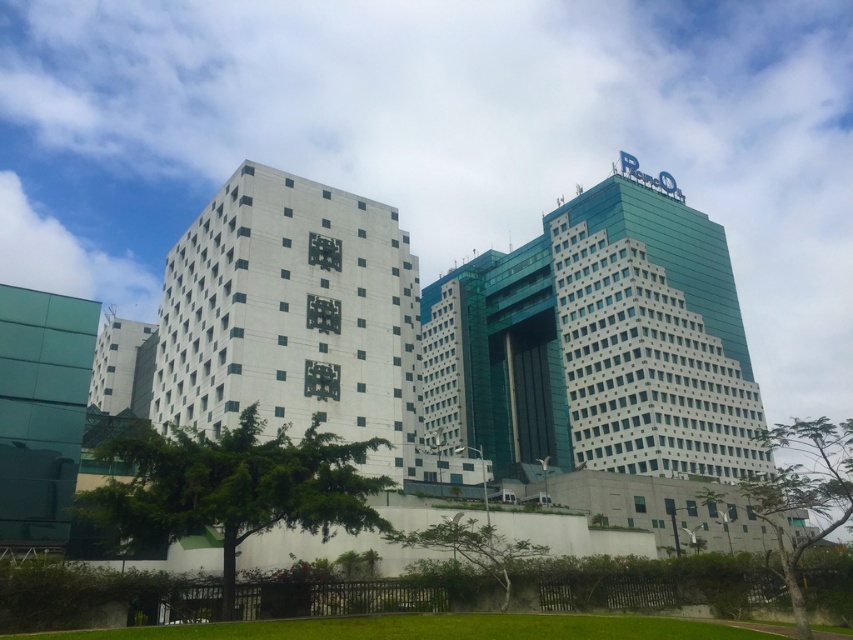
Is white matte building at center positioned before green leafy tree at center?

No, white matte building at center is behind green leafy tree at center.

Measure the distance between white matte building at center and green leafy tree at center.

A distance of 9.17 meters exists between white matte building at center and green leafy tree at center.

Locate an element on the screen. This screenshot has height=640, width=853. white matte building at center is located at coordinates (292, 317).

The image size is (853, 640). What are the coordinates of `white matte building at center` in the screenshot? It's located at (292, 317).

Is green leafy tree at center below green leafy tree at lower right?

No, green leafy tree at center is not below green leafy tree at lower right.

From the picture: Who is taller, green leafy tree at center or green leafy tree at lower right?

green leafy tree at lower right is taller.

Does point (264, 442) lie in front of point (815, 502)?

No, (264, 442) is behind (815, 502).

Where is `green leafy tree at center`? green leafy tree at center is located at coordinates (230, 486).

Is point (705, 317) positioned behind point (764, 509)?

Yes, it is behind point (764, 509).

Does point (705, 419) come behind point (799, 419)?

No, (705, 419) is in front of (799, 419).

This screenshot has width=853, height=640. I want to click on green glass building at center, so click(598, 342).